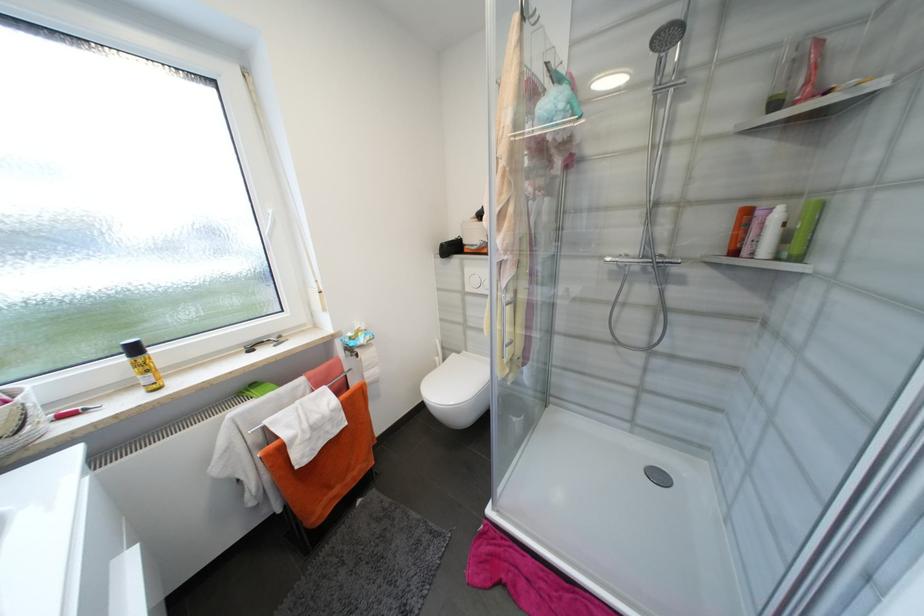
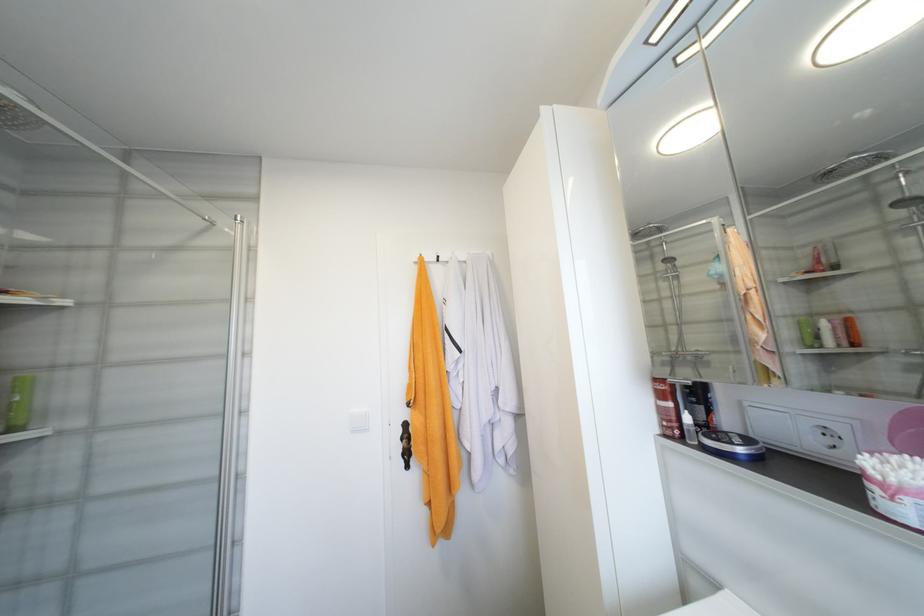
Find the pixel in the second image that matches [805,260] in the first image.

(19, 430)